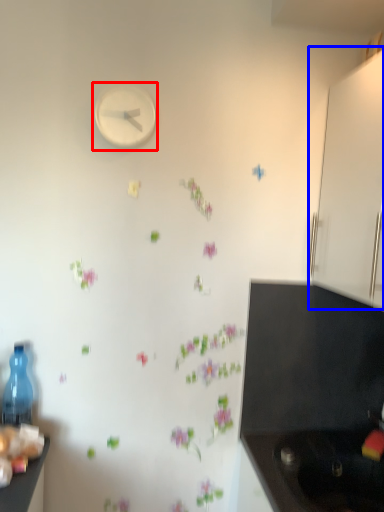
Question: Which point is further to the camera, clock (highlighted by a red box) or cabinetry (highlighted by a blue box)?

Choices:
 (A) clock
 (B) cabinetry

Answer: (A)